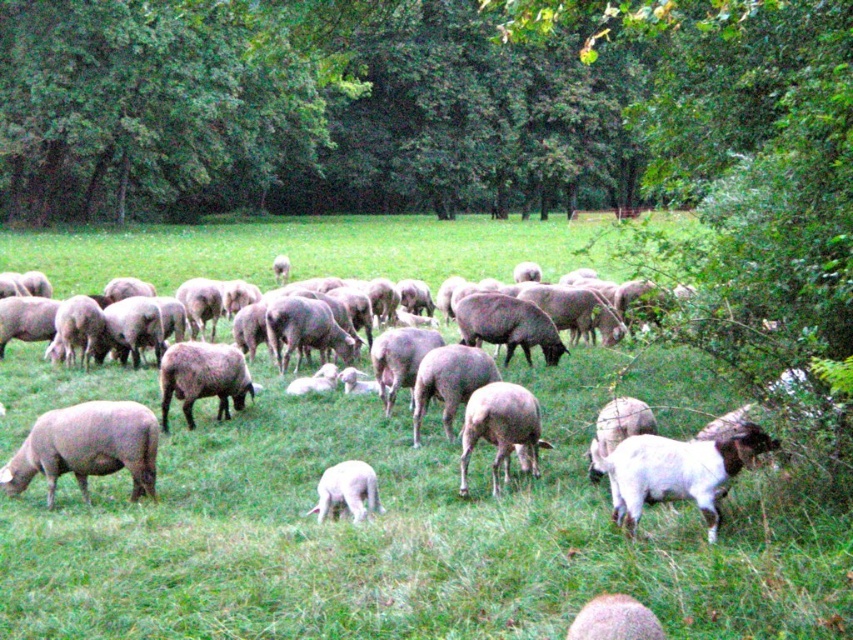
You are a shepherd trying to count your sheep. You notice the gray woolly sheep at lower left and the fuzzy woolly sheep at lower center. Which sheep is positioned more to the left side of the field?

The gray woolly sheep at lower left is positioned more to the left side of the field than the fuzzy woolly sheep at lower center.